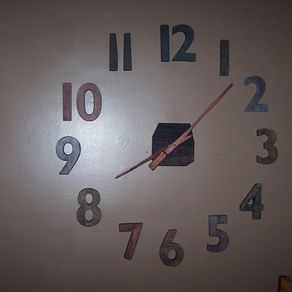
Find the location of a particular element. pivot point on clock hands is located at coordinates (175, 144).